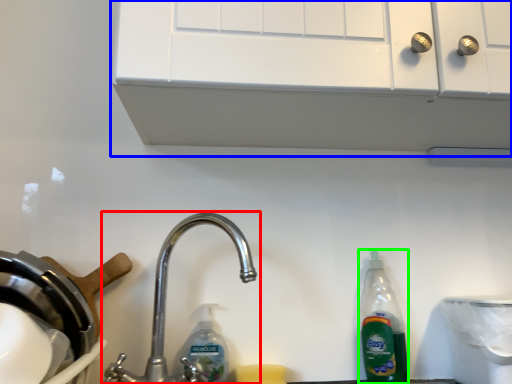
Question: Estimate the real-world distances between objects in this image. Which object is farther from tap (highlighted by a red box), vent (highlighted by a blue box) or bottle (highlighted by a green box)?

Choices:
 (A) vent
 (B) bottle

Answer: (A)